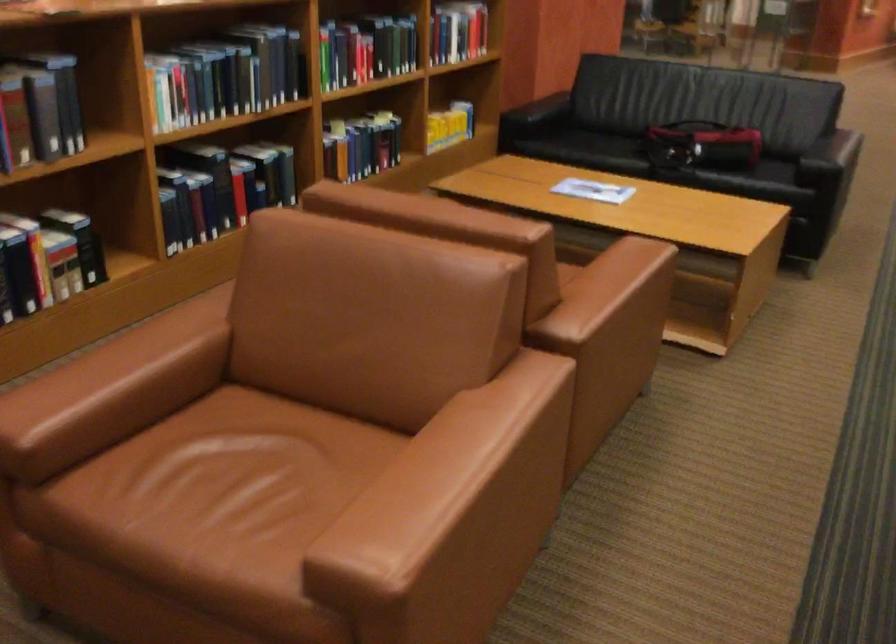
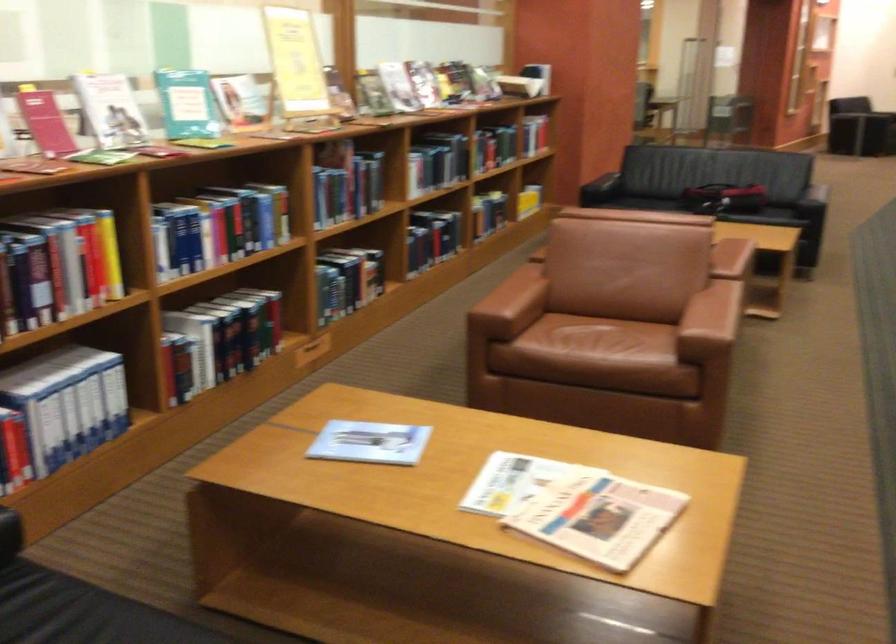
Find the pixel in the second image that matches pixel 238 485 in the first image.

(599, 342)